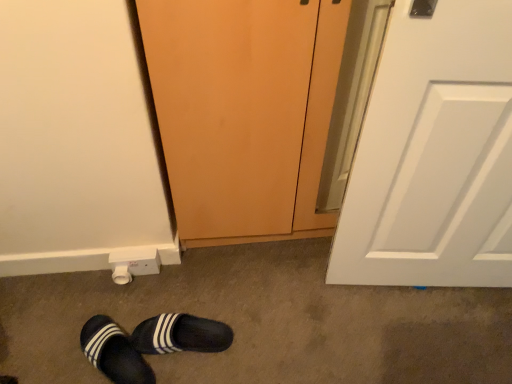
Question: Considering the positions of matte wood screen door at center and black suede slippers at lower left, the 1th footwear positioned from the right, in the image, is matte wood screen door at center wider or thinner than black suede slippers at lower left, the 1th footwear positioned from the right,?

Choices:
 (A) thin
 (B) wide

Answer: (B)

Question: In the image, is matte wood screen door at center positioned in front of or behind black suede slippers at lower left, the 1th footwear positioned from the right?

Choices:
 (A) front
 (B) behind

Answer: (A)

Question: Considering the real-world distances, which object is farthest from the matte wood screen door at center?

Choices:
 (A) black suede slippers at lower left, which is the second footwear in left-to-right order
 (B) white plastic electric outlet at lower left
 (C) black fabric slippers at lower left, marked as the 2th footwear in a right-to-left arrangement

Answer: (C)

Question: Estimate the real-world distances between objects in this image. Which object is closer to the black fabric slippers at lower left, marked as the 2th footwear in a right-to-left arrangement?

Choices:
 (A) matte wood screen door at center
 (B) white plastic electric outlet at lower left
 (C) black suede slippers at lower left, the 1th footwear positioned from the right

Answer: (C)